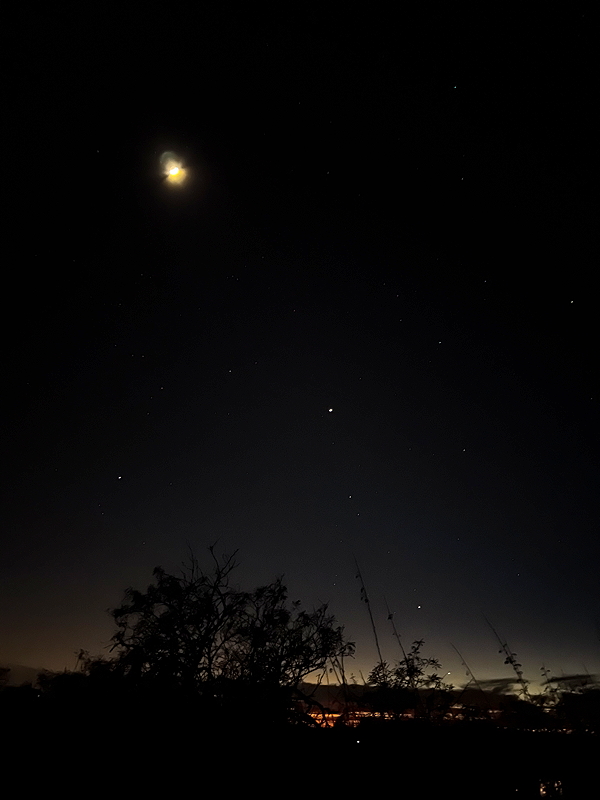
Locate an element on the screen. lights is located at coordinates (321, 714), (378, 714).